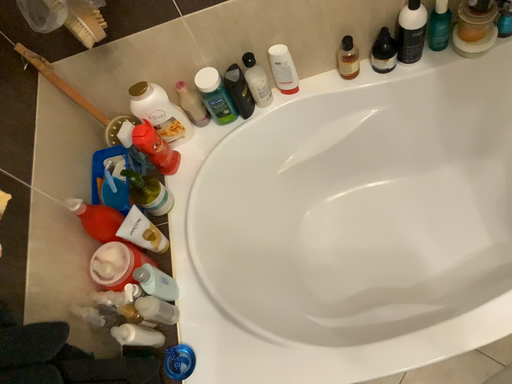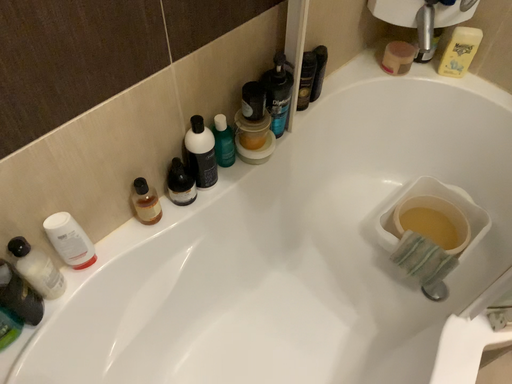
Question: Which way did the camera rotate in the video?

Choices:
 (A) rotated left
 (B) rotated right

Answer: (B)